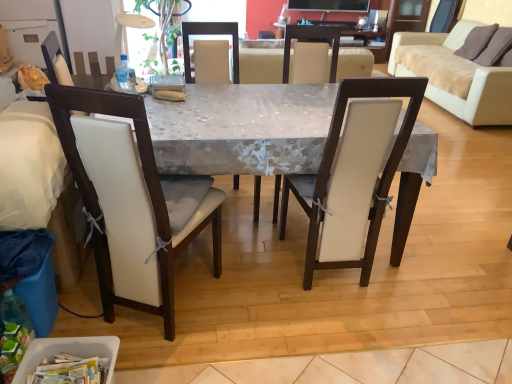
Question: Is beige fabric couch at upper right, the 1th studio couch viewed from the top, facing away from white plastic container at lower left?

Choices:
 (A) yes
 (B) no

Answer: (B)

Question: From the image's perspective, is beige fabric couch at upper right, which is counted as the first studio couch, starting from the right, over white plastic container at lower left?

Choices:
 (A) no
 (B) yes

Answer: (B)

Question: Does beige fabric couch at upper right, which is counted as the first studio couch, starting from the right, have a lesser width compared to white plastic container at lower left?

Choices:
 (A) no
 (B) yes

Answer: (A)

Question: Does beige fabric couch at upper right, the 1th studio couch viewed from the top, have a greater height compared to white plastic container at lower left?

Choices:
 (A) yes
 (B) no

Answer: (A)

Question: From the image's perspective, is beige fabric couch at upper right, the first studio couch positioned from the back, under white plastic container at lower left?

Choices:
 (A) yes
 (B) no

Answer: (B)

Question: Is beige fabric couch at upper right, the second studio couch positioned from the bottom, to the right of white plastic container at lower left from the viewer's perspective?

Choices:
 (A) yes
 (B) no

Answer: (A)

Question: Is the position of white leather chair at left, which is the 4th chair from right to left, more distant than that of beige fabric couch at upper right, which is counted as the first studio couch, starting from the right?

Choices:
 (A) no
 (B) yes

Answer: (A)

Question: Is beige fabric couch at upper right, which is counted as the first studio couch, starting from the right, completely or partially inside white leather chair at left, which is the 1th chair in left-to-right order?

Choices:
 (A) no
 (B) yes

Answer: (A)

Question: Can we say white leather chair at left, which is the 4th chair from right to left, lies outside beige fabric couch at upper right, which is counted as the first studio couch, starting from the right?

Choices:
 (A) no
 (B) yes

Answer: (B)

Question: Is white leather chair at left, which is the 1th chair in left-to-right order, positioned with its back to beige fabric couch at upper right, the 1th studio couch viewed from the top?

Choices:
 (A) yes
 (B) no

Answer: (B)

Question: Can you confirm if white leather chair at left, which is the 1th chair in left-to-right order, is smaller than beige fabric couch at upper right, marked as the 2th studio couch in a left-to-right arrangement?

Choices:
 (A) yes
 (B) no

Answer: (A)

Question: Can you confirm if white leather chair at left, which is the 1th chair in left-to-right order, is bigger than beige fabric couch at upper right, the 1th studio couch viewed from the top?

Choices:
 (A) yes
 (B) no

Answer: (B)

Question: From a real-world perspective, is white fabric chair at center, which ranks as the second chair in right-to-left order, positioned over white leather chair at center, which is the second chair from left to right, based on gravity?

Choices:
 (A) no
 (B) yes

Answer: (B)